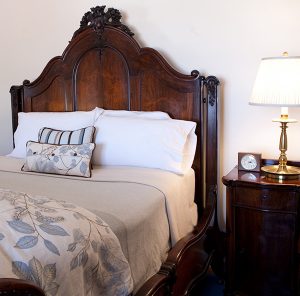
At what (x,y) coordinates should I click in order to perform the action: click on headboard. Please return your answer as a coordinate pair (x, y). The width and height of the screenshot is (300, 296). Looking at the image, I should click on (107, 76).